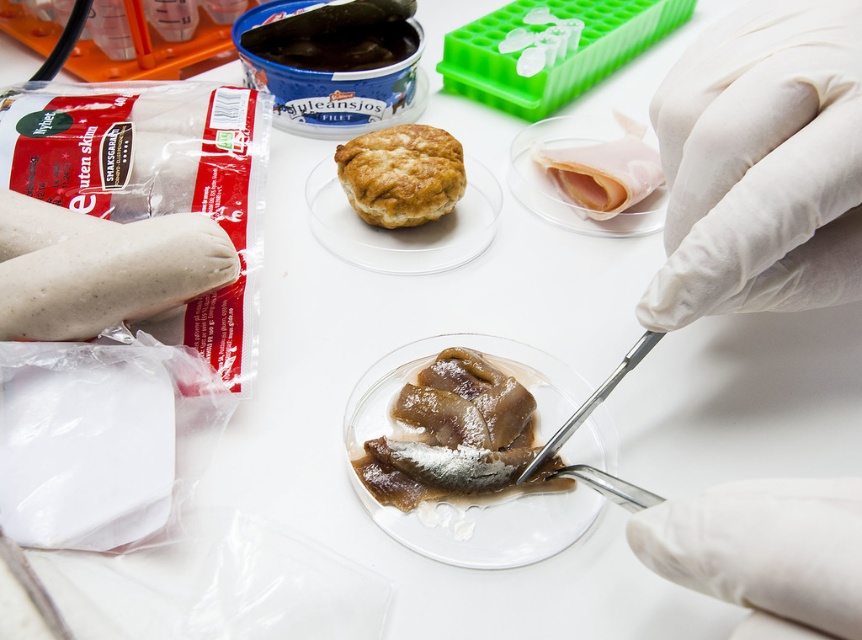
Measure the distance between white smooth glove at upper right and translucent gelatinous fish at center.

white smooth glove at upper right is 5.14 inches from translucent gelatinous fish at center.

How distant is white smooth glove at upper right from translucent gelatinous fish at center?

A distance of 5.14 inches exists between white smooth glove at upper right and translucent gelatinous fish at center.

Between point (822, 275) and point (489, 429), which one is positioned in front?

Point (822, 275) is more forward.

The image size is (862, 640). I want to click on white smooth glove at upper right, so click(x=761, y=164).

Who is more forward, (431, 228) or (316, 65)?

Point (431, 228) is more forward.

Is golden brown matte glass plate at center closer to the viewer compared to dark brown paste at center?

Yes, golden brown matte glass plate at center is closer to the viewer.

What are the coordinates of `golden brown matte glass plate at center` in the screenshot? It's located at (404, 227).

At what (x,y) coordinates should I click in order to perform the action: click on golden brown matte glass plate at center. Please return your answer as a coordinate pair (x, y). Looking at the image, I should click on (404, 227).

Is white latex glove at upper right closer to camera compared to translucent plastic plate at center?

Yes.

Who is shorter, white latex glove at upper right or translucent plastic plate at center?

With less height is translucent plastic plate at center.

Locate an element on the screen. white latex glove at upper right is located at coordinates (761, 164).

You are a GUI agent. You are given a task and a screenshot of the screen. Output one action in this format:
    pyautogui.click(x=<x>, y=<y>)
    Task: Click on the white latex glove at upper right
    The image size is (862, 640).
    Given the screenshot: What is the action you would take?
    pyautogui.click(x=761, y=164)